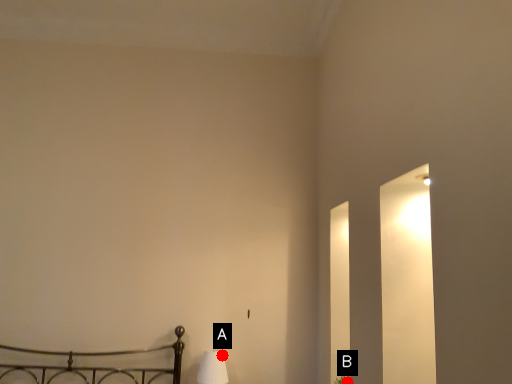
Question: Two points are circled on the image, labeled by A and B beside each circle. Which of the following is the closest to the observer?

Choices:
 (A) A is closer
 (B) B is closer

Answer: (B)